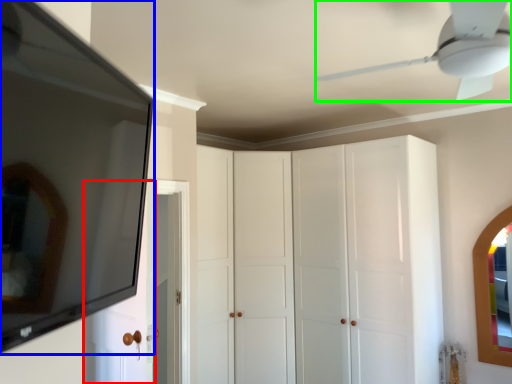
Question: Which object is the farthest from door (highlighted by a red box)? Choose among these: mirror (highlighted by a blue box) or ceiling fan (highlighted by a green box).

Choices:
 (A) mirror
 (B) ceiling fan

Answer: (B)